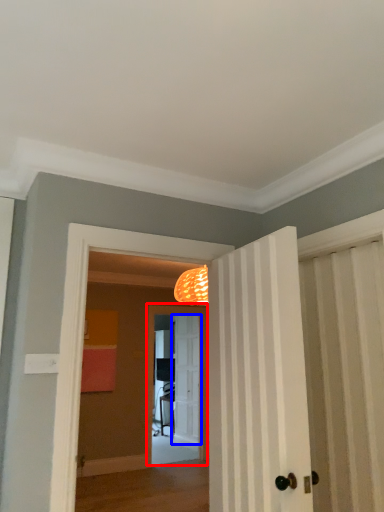
Question: Among these objects, which one is nearest to the camera, screen door (highlighted by a red box) or door (highlighted by a blue box)?

Choices:
 (A) screen door
 (B) door

Answer: (A)